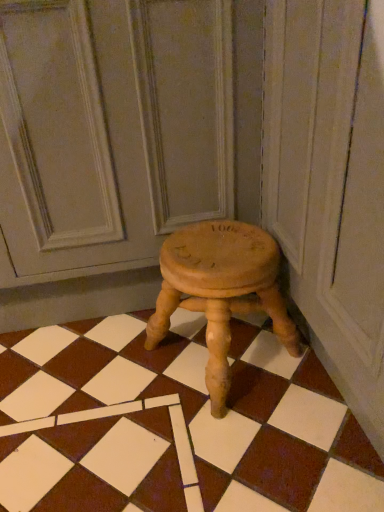
You are a GUI agent. You are given a task and a screenshot of the screen. Output one action in this format:
    pyautogui.click(x=<x>, y=<y>)
    Task: Click on the vacant area situated below wooden stool at center (from a real-world perspective)
    The width and height of the screenshot is (384, 512).
    Given the screenshot: What is the action you would take?
    pyautogui.click(x=206, y=357)